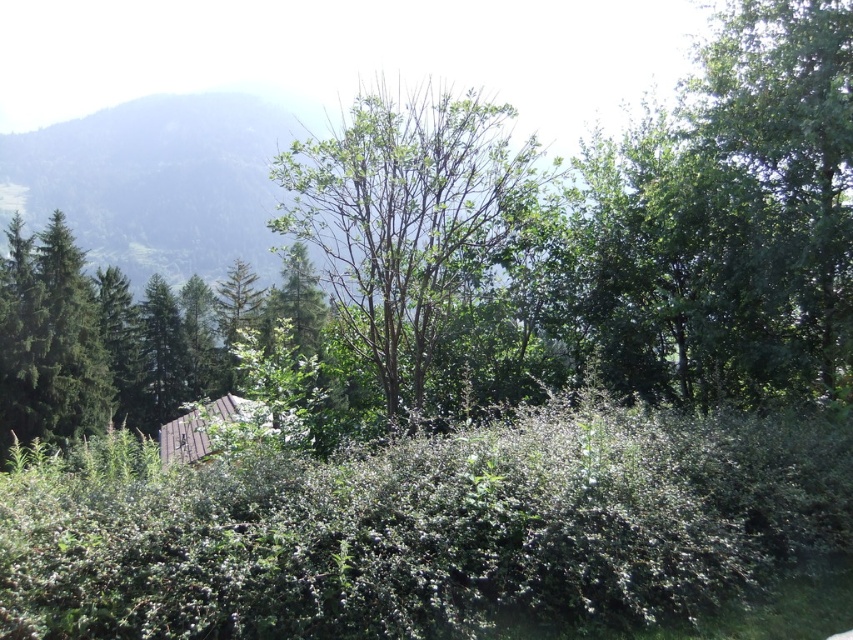
Can you confirm if green leafy hedge at center is positioned above green leafy tree at center?

No, green leafy hedge at center is not above green leafy tree at center.

Can you confirm if green leafy hedge at center is wider than green leafy tree at center?

No, green leafy hedge at center is not wider than green leafy tree at center.

Who is more forward, (x=460, y=545) or (x=389, y=413)?

Point (x=460, y=545)

Find the location of a particular element. This screenshot has height=640, width=853. green leafy hedge at center is located at coordinates (422, 525).